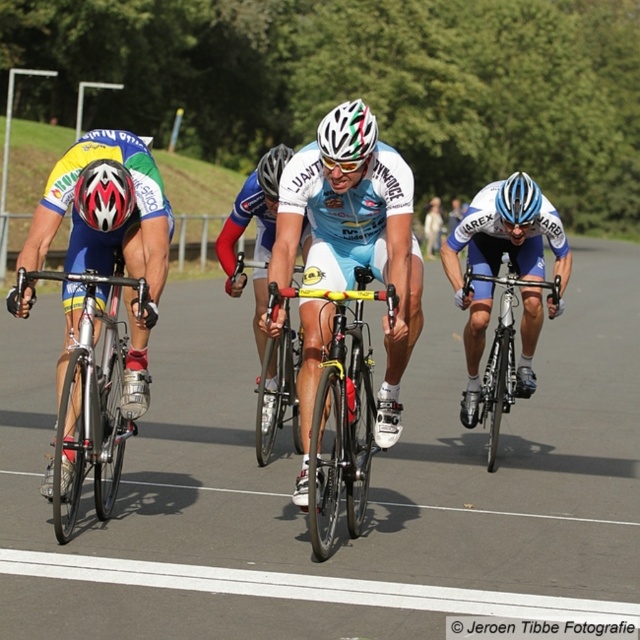
You are a photographer standing at the starting line of the race. You want to take a closeup photo of the light blue fabric jersey at center. Given that your camera can focus on objects within 5 meters, will you be able to capture a clear closeup?

The light blue fabric jersey at center is 6.71 meters away from the viewer, which is beyond the camera focus range of 5 meters. Therefore, you won